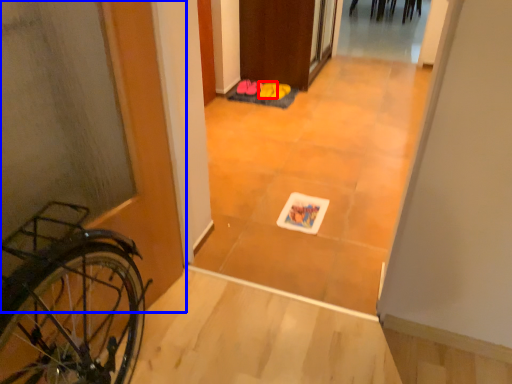
Question: Which object is closer to the camera taking this photo, footwear (highlighted by a red box) or door (highlighted by a blue box)?

Choices:
 (A) footwear
 (B) door

Answer: (B)